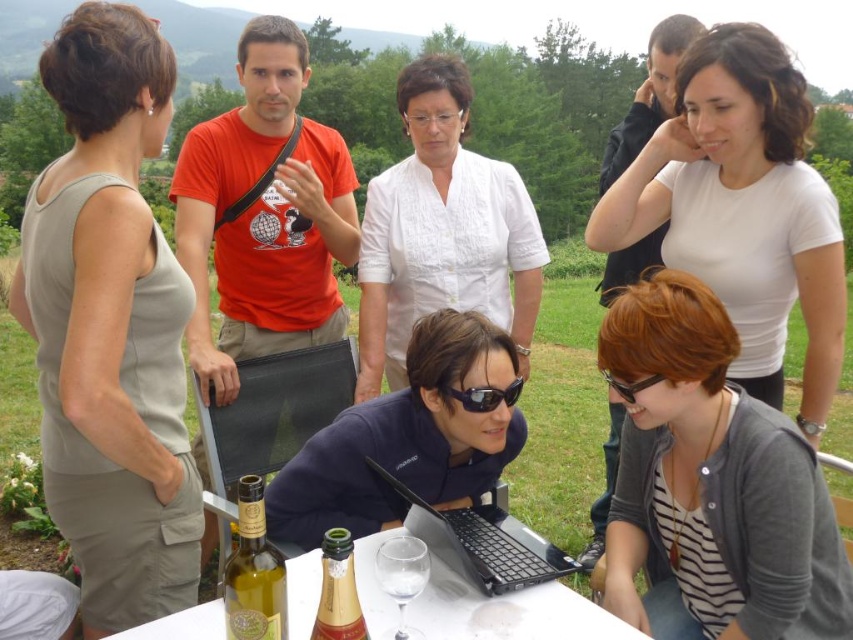
You are a photographer trying to capture a candid shot of the matte beige dress at left and the black plastic laptop at center. Since you want to ensure both subjects are in focus, you need to know their relative heights. Which object is taller?

The matte beige dress at left is much taller as black plastic laptop at center.